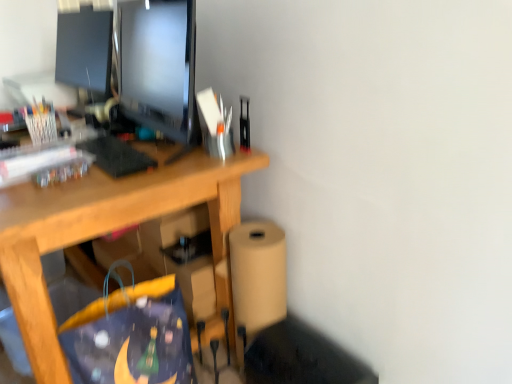
Question: In terms of size, does blue fabric shopping bag at lower center appear bigger or smaller than metallic silver stapler at upper right, the first stationery positioned from the right?

Choices:
 (A) small
 (B) big

Answer: (B)

Question: In terms of height, does blue fabric shopping bag at lower center look taller or shorter compared to metallic silver stapler at upper right, positioned as the first stationery in front-to-back order?

Choices:
 (A) short
 (B) tall

Answer: (B)

Question: Which object is the farthest from the matte black monitor at upper left?

Choices:
 (A) blue fabric shopping bag at lower center
 (B) metallic silver stapler at upper right, positioned as the second stationery in back-to-front order
 (C) translucent plastic pen holder at upper left, which is the 2th stationery from front to back

Answer: (A)

Question: Estimate the real-world distances between objects in this image. Which object is closer to the translucent plastic pen holder at upper left, which appears as the second stationery when viewed from the right?

Choices:
 (A) matte black monitor at upper left
 (B) metallic silver stapler at upper right, which is the second stationery from left to right
 (C) blue fabric shopping bag at lower center

Answer: (A)